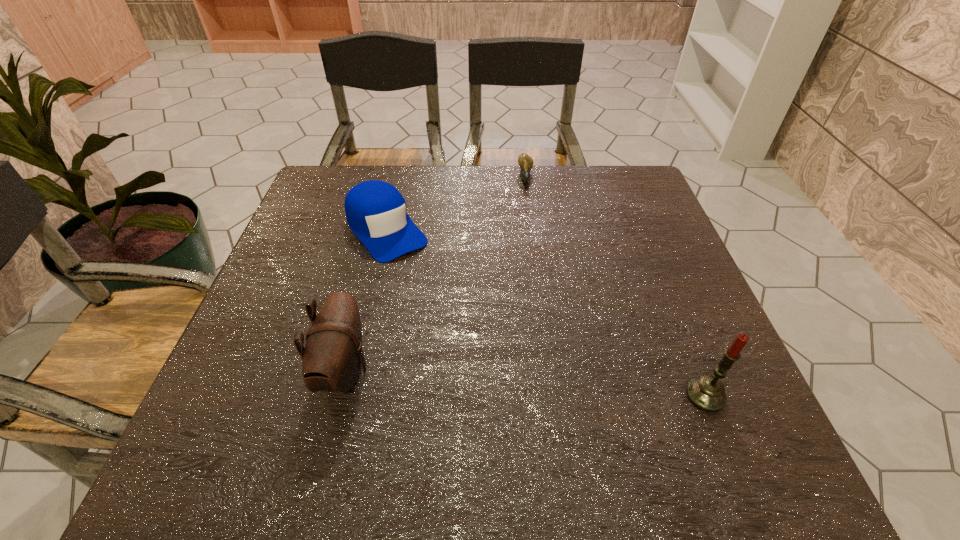
I want to click on pouch, so click(x=331, y=360).

You are a GUI agent. You are given a task and a screenshot of the screen. Output one action in this format:
    pyautogui.click(x=<x>, y=<y>)
    Task: Click on the rightmost object
    The width and height of the screenshot is (960, 540).
    Given the screenshot: What is the action you would take?
    pyautogui.click(x=707, y=393)

This screenshot has height=540, width=960. I want to click on baseball cap, so click(x=375, y=210).

The height and width of the screenshot is (540, 960). I want to click on the second farthest object, so click(x=375, y=210).

Image resolution: width=960 pixels, height=540 pixels. Find the location of `the farthest object`. the farthest object is located at coordinates (525, 162).

This screenshot has height=540, width=960. Find the location of `escargot`. escargot is located at coordinates (525, 162).

The width and height of the screenshot is (960, 540). Find the location of `vacant space situated 0.260m with the flap open on the pouch`. vacant space situated 0.260m with the flap open on the pouch is located at coordinates (506, 370).

You are a GUI agent. You are given a task and a screenshot of the screen. Output one action in this format:
    pyautogui.click(x=<x>, y=<y>)
    Task: Click on the vacant space situated 0.350m on the left of the rightmost object
    The width and height of the screenshot is (960, 540).
    Given the screenshot: What is the action you would take?
    pyautogui.click(x=493, y=395)

The width and height of the screenshot is (960, 540). Find the location of `free region located on the front-facing side of the third tallest object`. free region located on the front-facing side of the third tallest object is located at coordinates (426, 282).

Locate an element on the screen. Image resolution: width=960 pixels, height=540 pixels. vacant point located 0.220m on the front-facing side of the third tallest object is located at coordinates point(453,315).